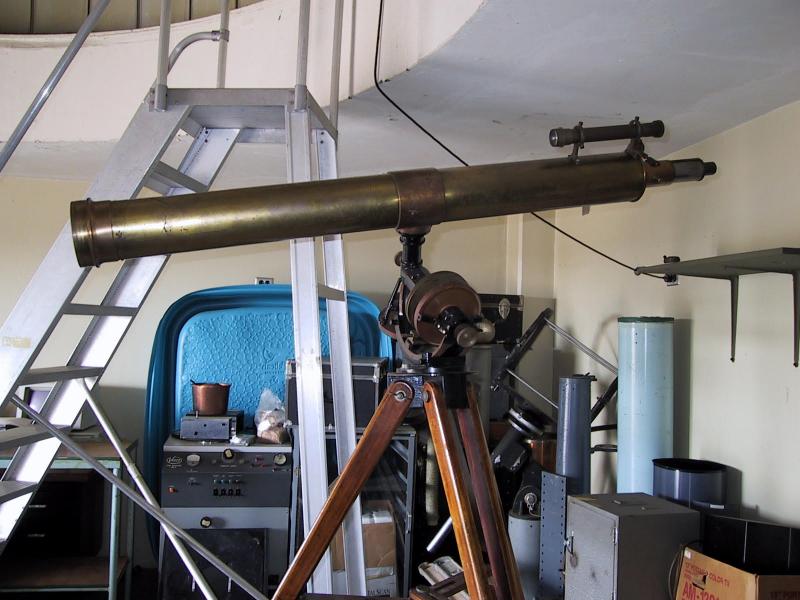
What are the coordinates of `shelf on wall` in the screenshot? It's located at (737, 256).